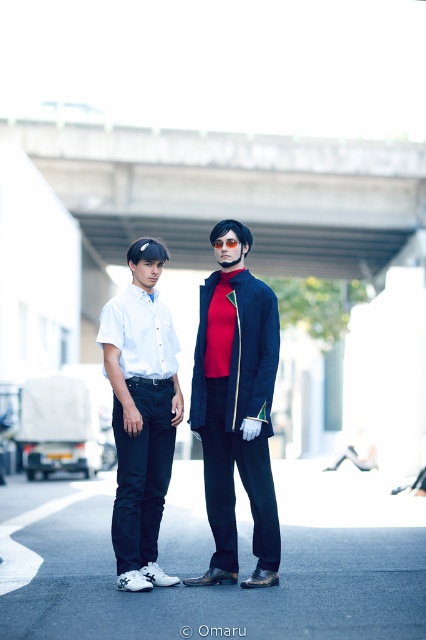
You are a photographer trying to capture the matte black jacket at center in your shot. Based on the scene description, where should you position your camera to ensure the jacket is centered in the frame?

To center the matte black jacket at center in the frame, position your camera so that the jacket aligns with the center point of your viewfinder, which corresponds to the coordinates mentioned in the description.

You are standing at the point with coordinates point (149, 404) and want to walk towards the point with coordinates point (241, 284). Will you be moving forward or backward relative to your current position?

Since point (241, 284) is behind point (149, 404), moving towards it would mean you are moving backward relative to your current position.

You are a photographer trying to capture both the matte black jacket at center and the white glossy shirt at center in a single frame. Which object should you focus on first to ensure both are in focus, considering their heights?

The matte black jacket at center is taller than the white glossy shirt at center, so focusing on the taller object first will help ensure both are in focus.